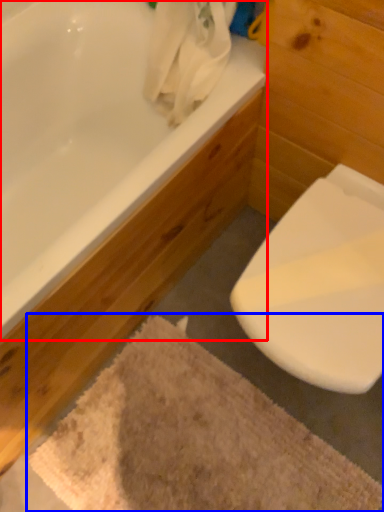
Question: Among these objects, which one is nearest to the camera, bathtub (highlighted by a red box) or bath mat (highlighted by a blue box)?

Choices:
 (A) bathtub
 (B) bath mat

Answer: (A)